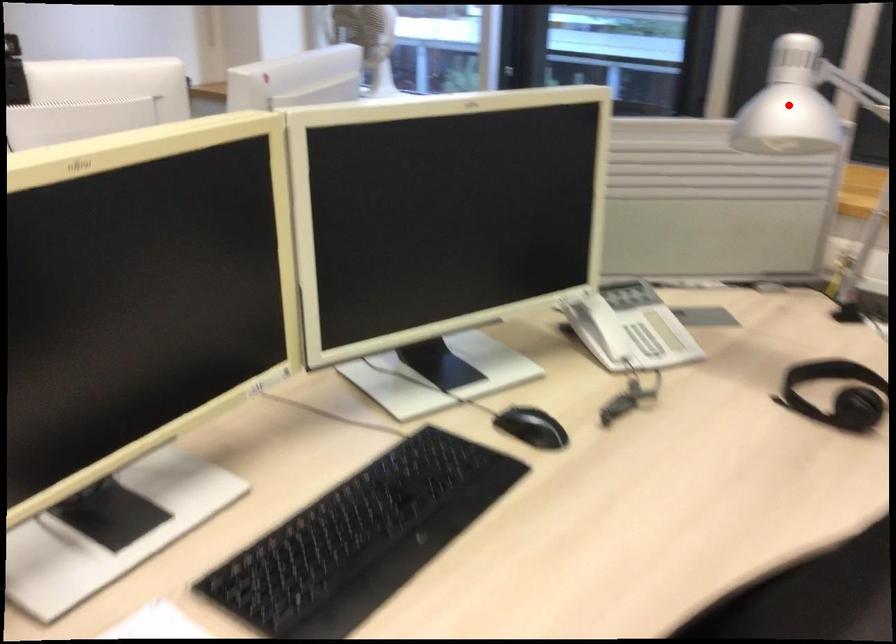
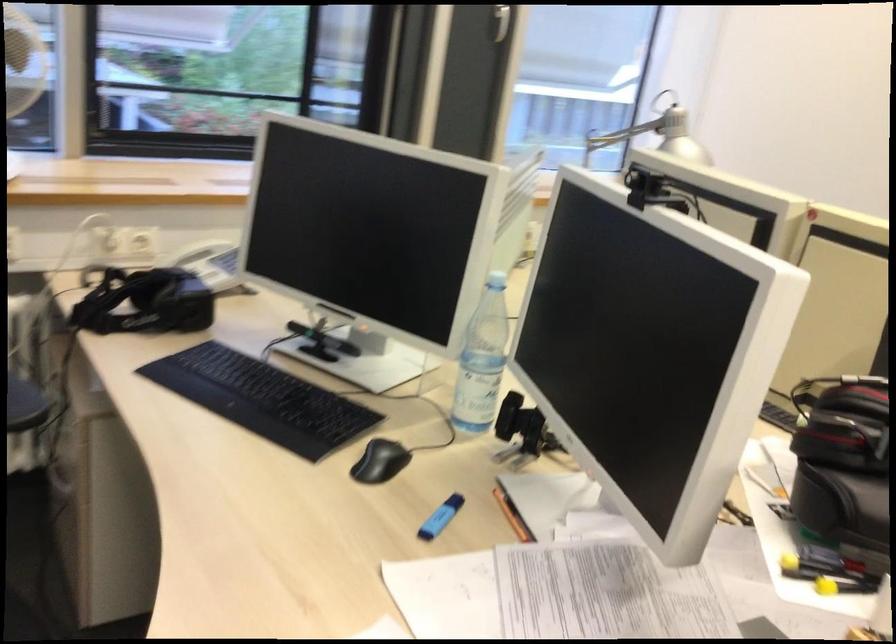
Question: I am providing you with two images of the same scene from different viewpoints. Given a red point in image1, look at the same physical point in image2. Is it:

Choices:
 (A) Closer to the viewpoint
 (B) Farther from the viewpoint

Answer: (B)